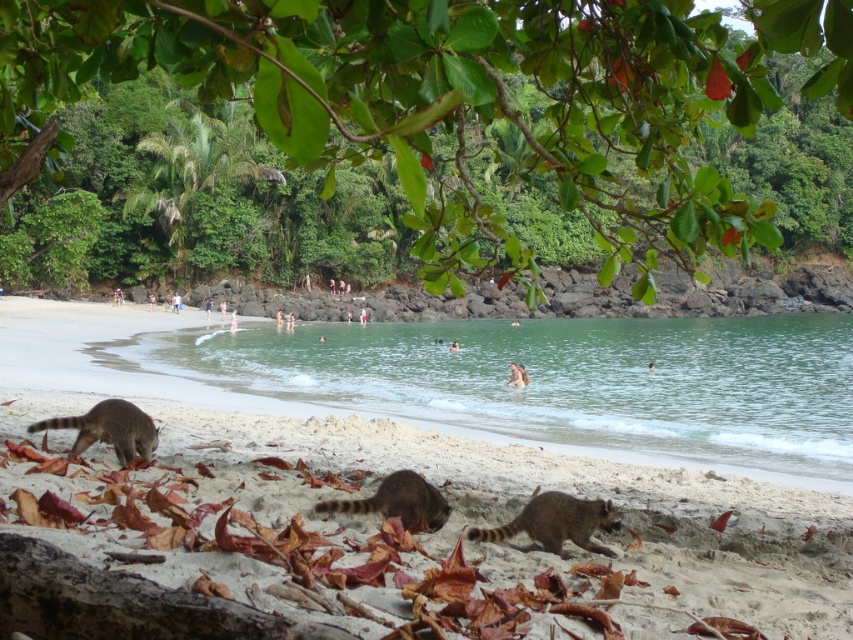
Question: Does brown sandy beach at lower center come behind brown fur raccoon at center?

Choices:
 (A) yes
 (B) no

Answer: (B)

Question: Based on their relative distances, which object is farther from the brown fur raccoon at lower center?

Choices:
 (A) clear water at beach center
 (B) brown fur raccoon at center
 (C) green leafy tree at upper center
 (D) brown fur raccoon at lower left

Answer: (A)

Question: Can you confirm if brown sandy beach at lower center is bigger than brown fur raccoon at lower left?

Choices:
 (A) yes
 (B) no

Answer: (A)

Question: Which of these objects is positioned closest to the brown fur raccoon at lower left?

Choices:
 (A) brown fur raccoon at lower center
 (B) brown fur raccoon at center

Answer: (B)

Question: Does brown sandy beach at lower center come in front of clear water at beach center?

Choices:
 (A) yes
 (B) no

Answer: (A)

Question: Among these objects, which one is farthest from the camera?

Choices:
 (A) brown fur raccoon at lower center
 (B) clear water at beach center
 (C) green leafy tree at upper center
 (D) brown sandy beach at lower center

Answer: (B)